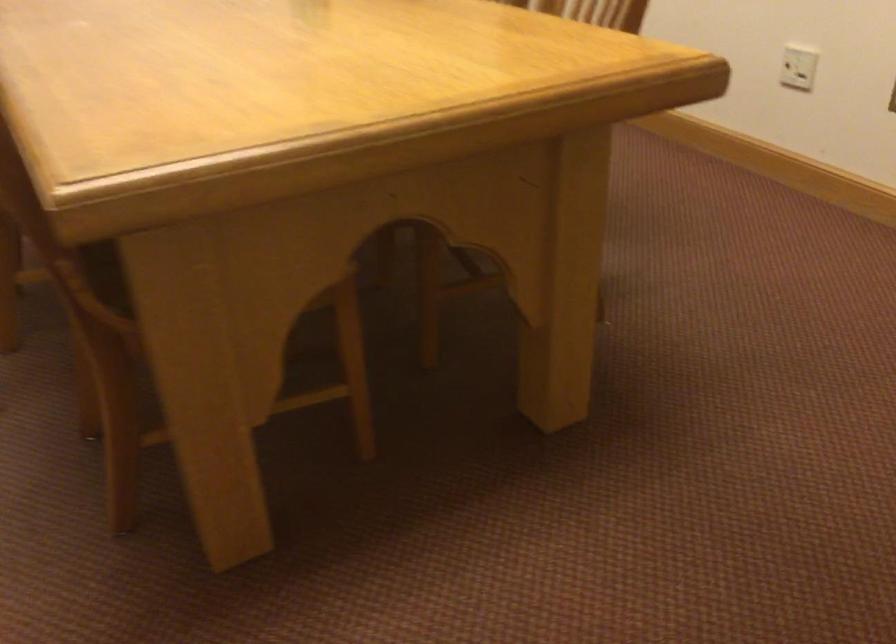
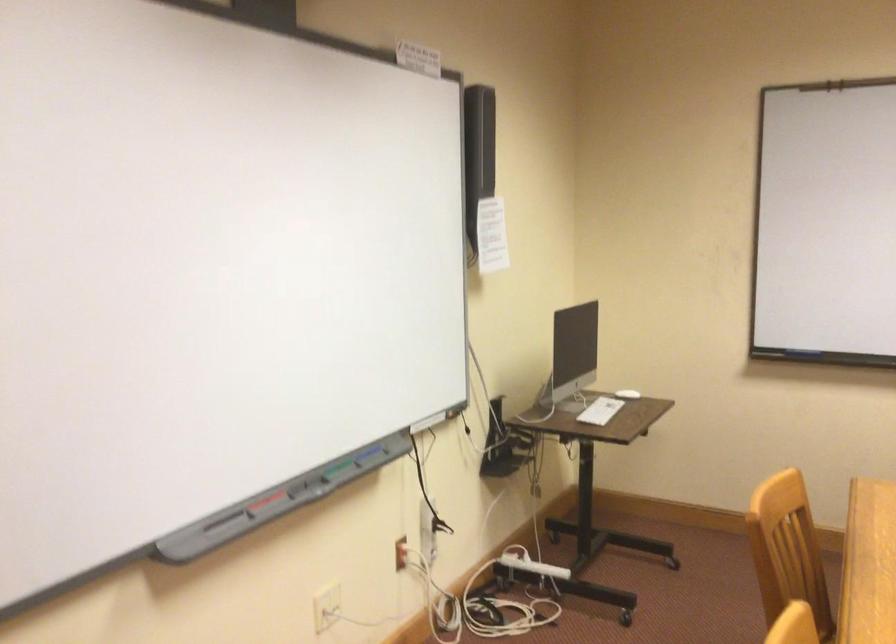
Question: The camera is either moving clockwise (left) or counter-clockwise (right) around the object. The first image is from the beginning of the video and the second image is from the end. Is the camera moving left or right when shooting the video?

Choices:
 (A) Left
 (B) Right

Answer: (B)